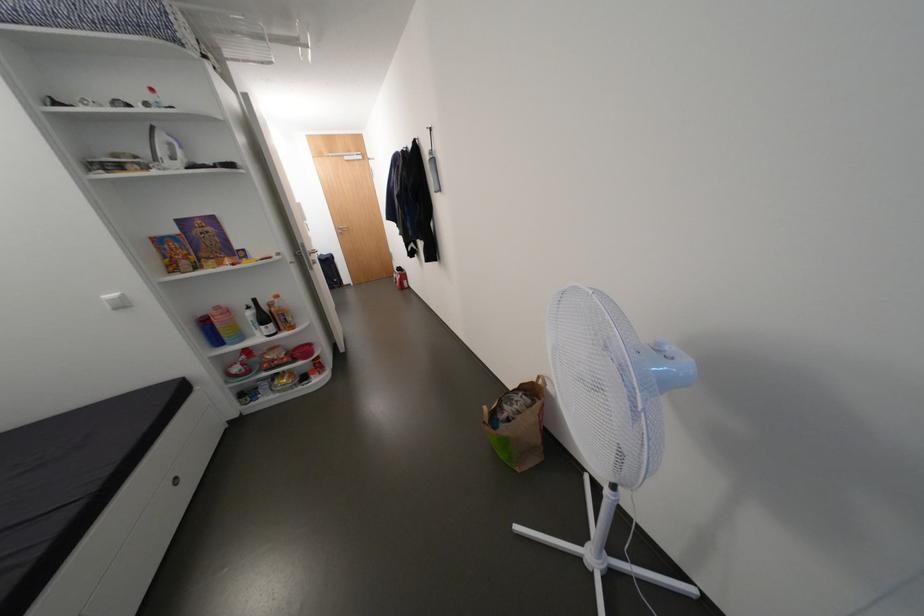
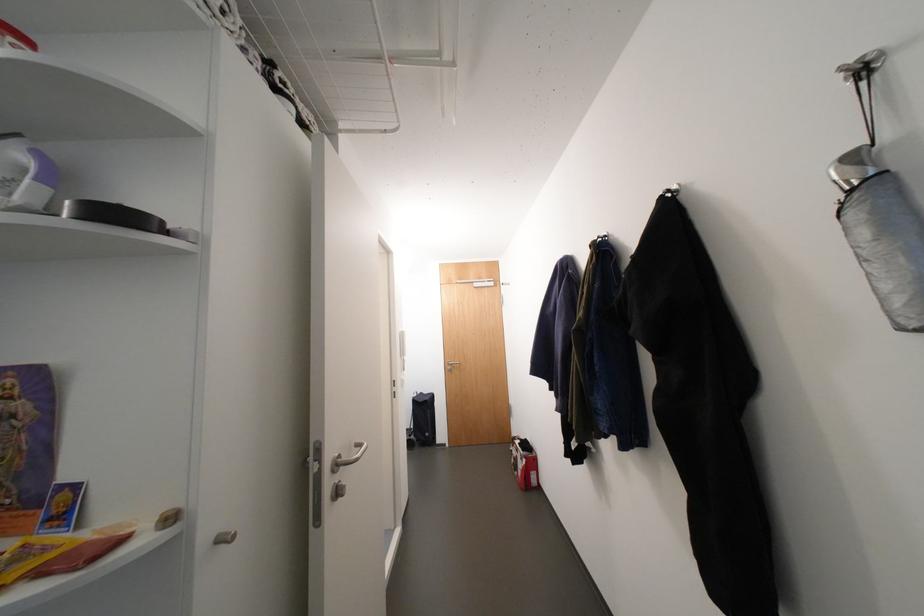
In the second image, find the point that corresponds to [434,129] in the first image.

(855, 71)